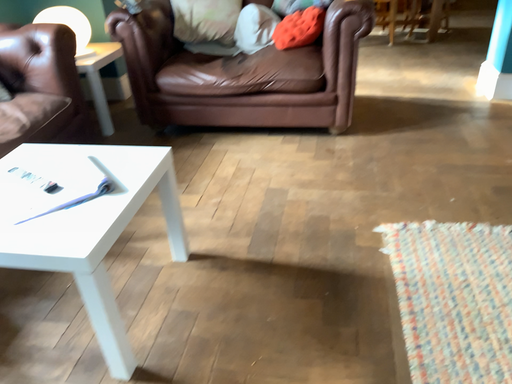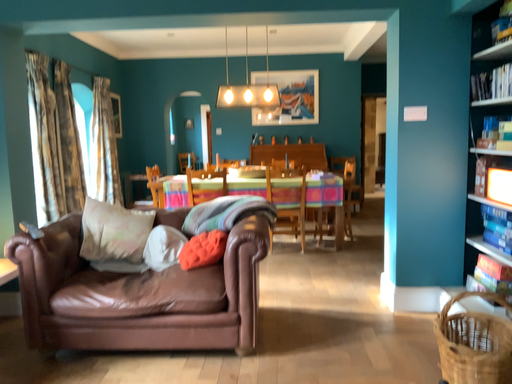
Question: Which way did the camera rotate in the video?

Choices:
 (A) rotated downward
 (B) rotated upward

Answer: (B)